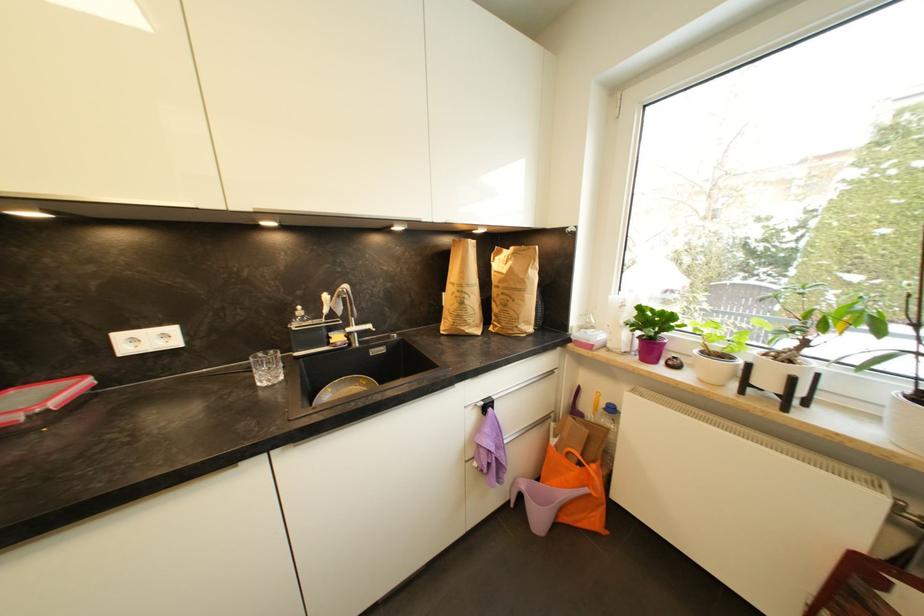
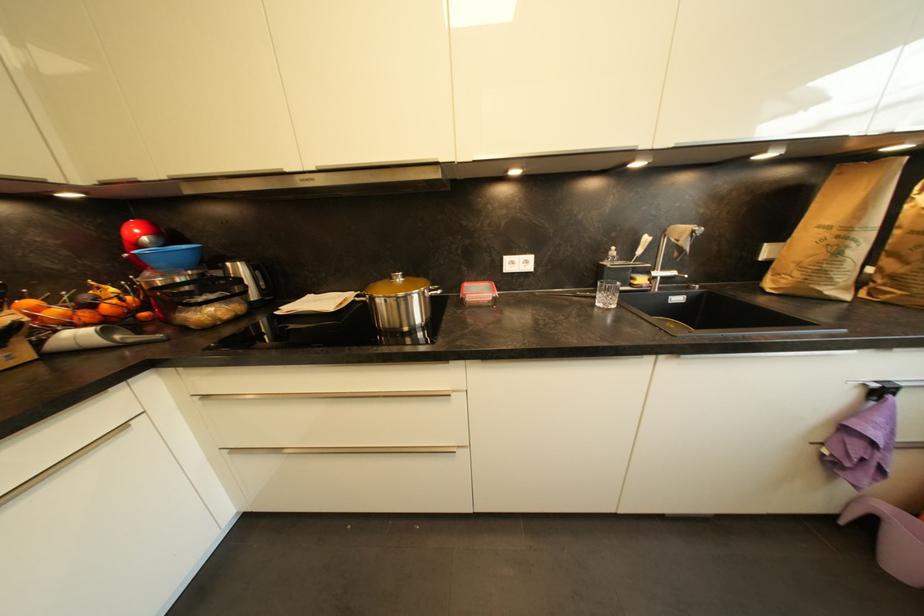
Question: Based on the continuous images, in which direction is the camera rotating? Reply with the corresponding letter.

Choices:
 (A) Left
 (B) Right
 (C) Up
 (D) Down

Answer: (A)